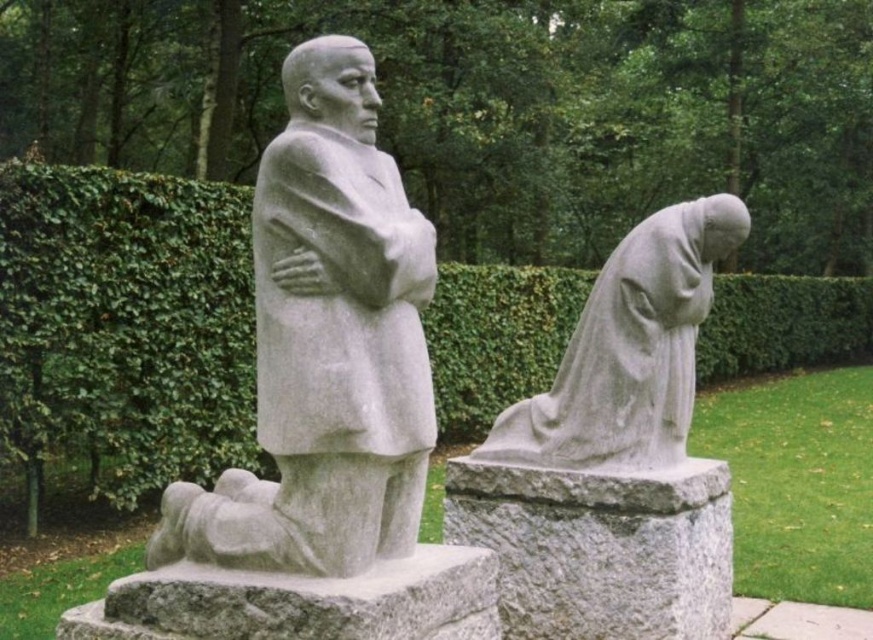
You are a park visitor standing at the entrance of the park. You see the white stone statue at center and the gray stone statue at lower right. Which statue is located higher in the image?

The white stone statue at center is positioned over the gray stone statue at lower right, meaning it is higher up in the image.

You are a visitor in the park and want to take a photo of both the white stone statue at center and the gray stone statue at lower right. Which statue should you position closer to the left side of your camera frame to include both in the photo?

Since the white stone statue at center is to the left of the gray stone statue at lower right, you should position the white stone statue at center closer to the left side of your camera frame to include both in the photo.

Looking at this image, you are a park visitor who wants to take a photo of both the white stone statue at center and the gray stone statue at lower right in the same frame. Based on their sizes, which statue should you stand closer to in order to include both in your photo?

Since the white stone statue at center is larger in size than the gray stone statue at lower right, you should stand closer to the gray stone statue at lower right to ensure both statues appear balanced in the photo frame.